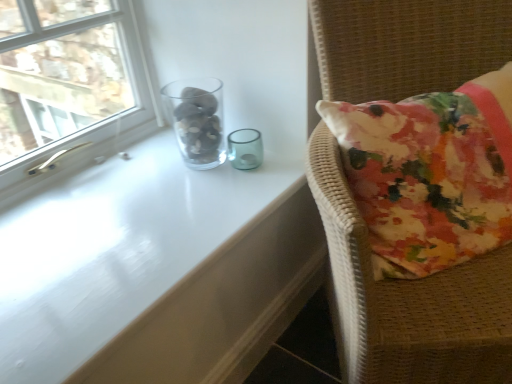
Question: Based on their sizes in the image, would you say transparent glass vase at upper left is bigger or smaller than clear glass window at upper left?

Choices:
 (A) big
 (B) small

Answer: (B)

Question: Is transparent glass vase at upper left inside the boundaries of clear glass window at upper left, or outside?

Choices:
 (A) inside
 (B) outside

Answer: (B)

Question: Which object is the farthest from the transparent glass vase at upper left?

Choices:
 (A) clear glass window at upper left
 (B) floral fabric cushion at right
 (C) transparent glass table at upper center

Answer: (A)

Question: Based on their relative distances, which object is farther from the floral fabric cushion at right?

Choices:
 (A) clear glass window at upper left
 (B) transparent glass table at upper center
 (C) transparent glass vase at upper left

Answer: (A)